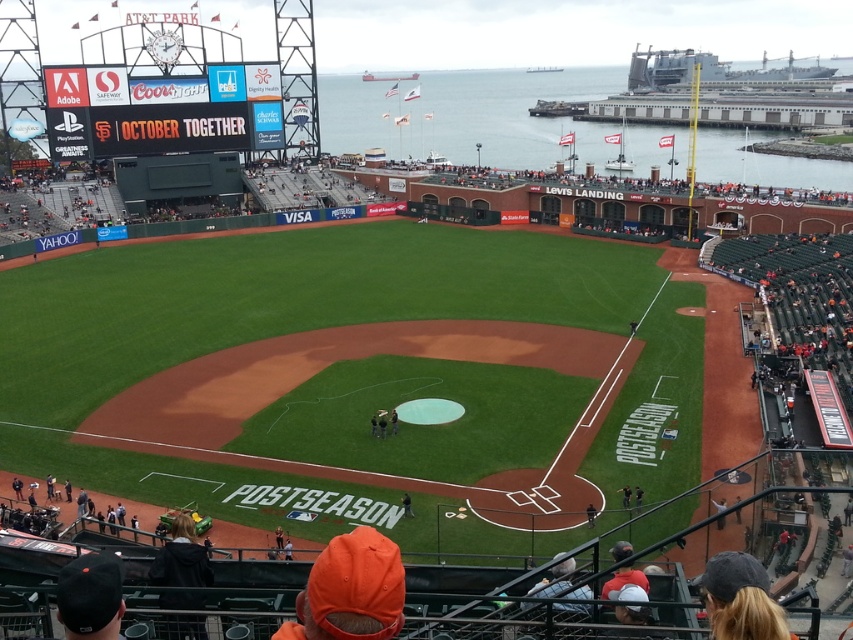
Question: Among these objects, which one is nearest to the camera?

Choices:
 (A) dark gray uniform at center
 (B) black uniform at center
 (C) orange fabric cap at lower center

Answer: (C)

Question: Is orange baseball cap at lower center wider than black uniform at center?

Choices:
 (A) no
 (B) yes

Answer: (A)

Question: Is orange fabric cap at lower center closer to the viewer compared to black uniform at center?

Choices:
 (A) yes
 (B) no

Answer: (A)

Question: Is orange fabric cap at lower center positioned at the back of dark gray uniform at center?

Choices:
 (A) no
 (B) yes

Answer: (A)

Question: Which point is closer to the camera?

Choices:
 (A) black uniform at center
 (B) matte black scoreboard at upper center
 (C) dark brown leather jacket at lower left
 (D) orange fabric cap at lower center

Answer: (D)

Question: Among these points, which one is farthest from the camera?

Choices:
 (A) (183, 637)
 (B) (593, 512)

Answer: (B)